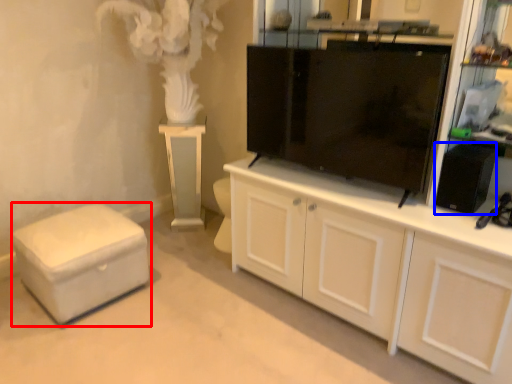
Question: Among these objects, which one is nearest to the camera, furniture (highlighted by a red box) or appliance (highlighted by a blue box)?

Choices:
 (A) furniture
 (B) appliance

Answer: (B)